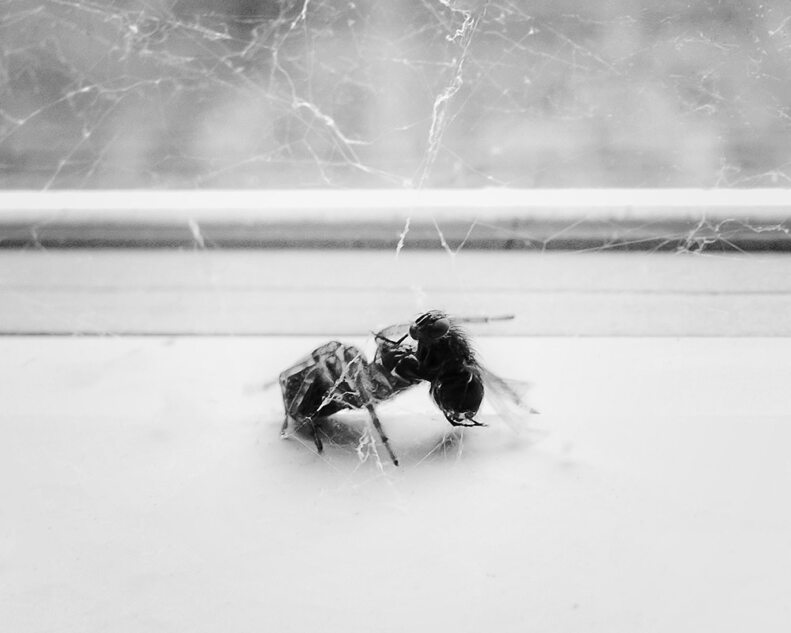
At what (x,y) coordinates should I click in order to perform the action: click on floor. Please return your answer as a coordinate pair (x, y). The image size is (791, 633). Looking at the image, I should click on click(x=493, y=522).